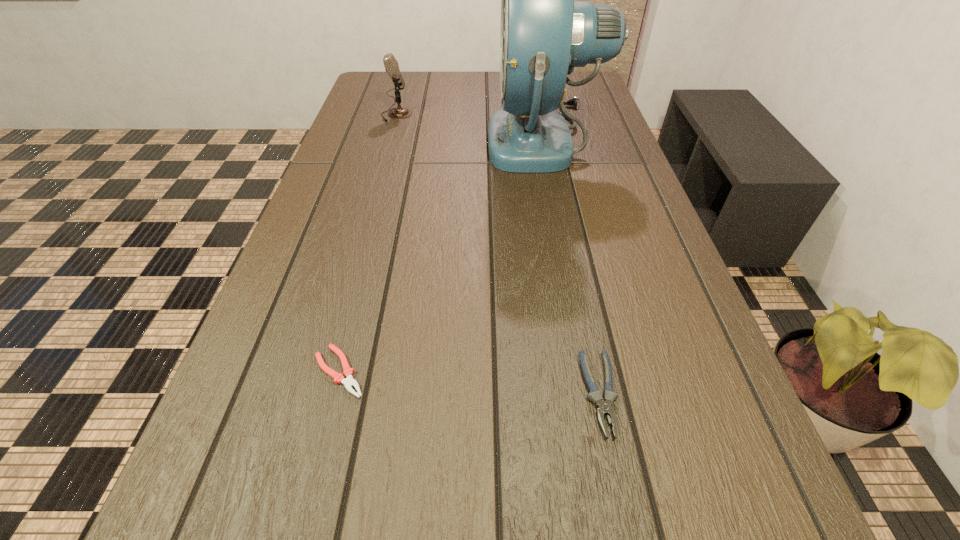
Locate an element on the screen. vacant space situated 0.050m at the gripping part of the taller pliers is located at coordinates coord(617,477).

Find the location of a particular element. free location located 0.250m on the back of the shorter pliers is located at coordinates (372, 246).

What are the coordinates of `microphone at the left edge` in the screenshot? It's located at (391, 65).

This screenshot has width=960, height=540. What are the coordinates of `pliers at the left edge` in the screenshot? It's located at (349, 382).

Where is `object present at the right edge`? Image resolution: width=960 pixels, height=540 pixels. object present at the right edge is located at coordinates (544, 34).

In the image, there is a desktop. At what (x,y) coordinates should I click in order to perform the action: click on vacant space at the far edge. Please return your answer as a coordinate pair (x, y). This screenshot has width=960, height=540. Looking at the image, I should click on (424, 84).

Identify the location of vacant space at the left edge of the desktop. The height and width of the screenshot is (540, 960). (316, 449).

You are a GUI agent. You are given a task and a screenshot of the screen. Output one action in this format:
    pyautogui.click(x=<x>, y=<y>)
    Task: Click on the vacant space at the right edge
    
    Given the screenshot: What is the action you would take?
    pyautogui.click(x=629, y=250)

In the image, there is a desktop. Where is `vacant region at the far left corner`? The height and width of the screenshot is (540, 960). vacant region at the far left corner is located at coordinates (363, 102).

At what (x,y) coordinates should I click in order to perform the action: click on blank region between the shortest object and the third shortest object. Please return your answer as a coordinate pair (x, y). The width and height of the screenshot is (960, 540). Looking at the image, I should click on (368, 243).